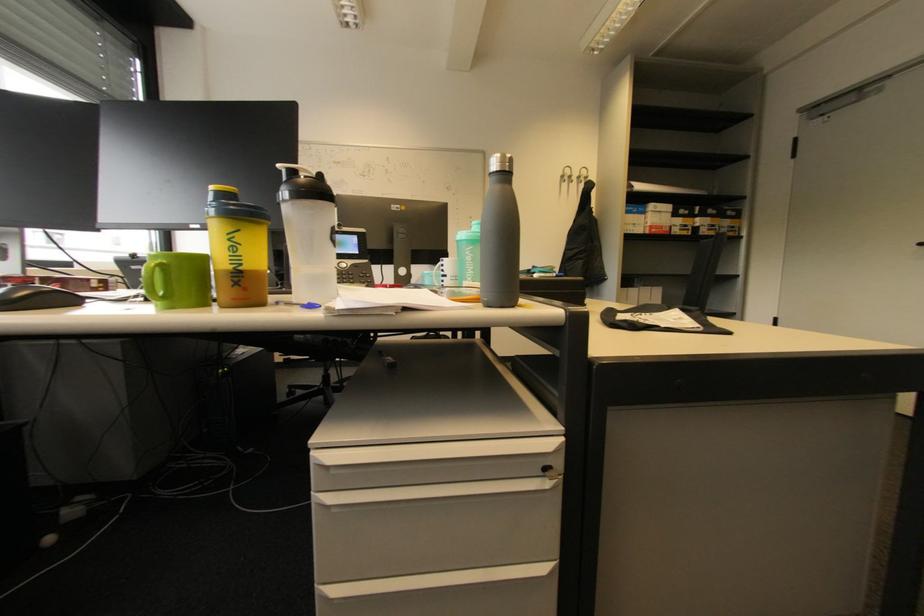
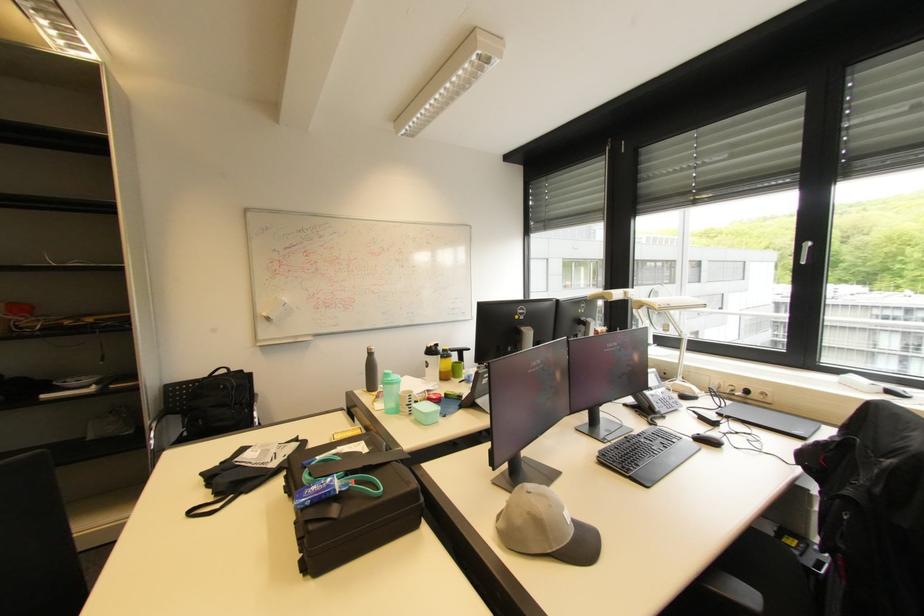
Question: I am providing you with two images of the same scene from different viewpoints. After the viewpoint changes to image2, which objects are now occluded?

Choices:
 (A) small green container
 (B) orange level tool
 (C) cabinet drawer handle
 (D) white window handle

Answer: (C)